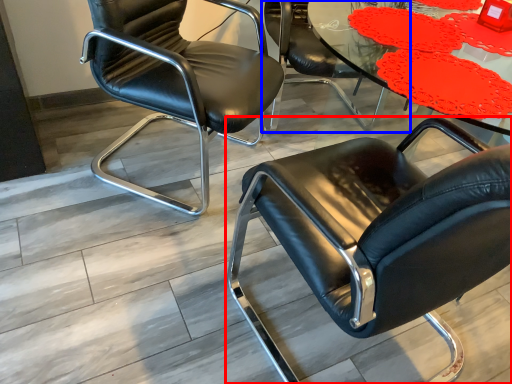
Question: Which object is further to the camera taking this photo, chair (highlighted by a red box) or chair (highlighted by a blue box)?

Choices:
 (A) chair
 (B) chair

Answer: (B)